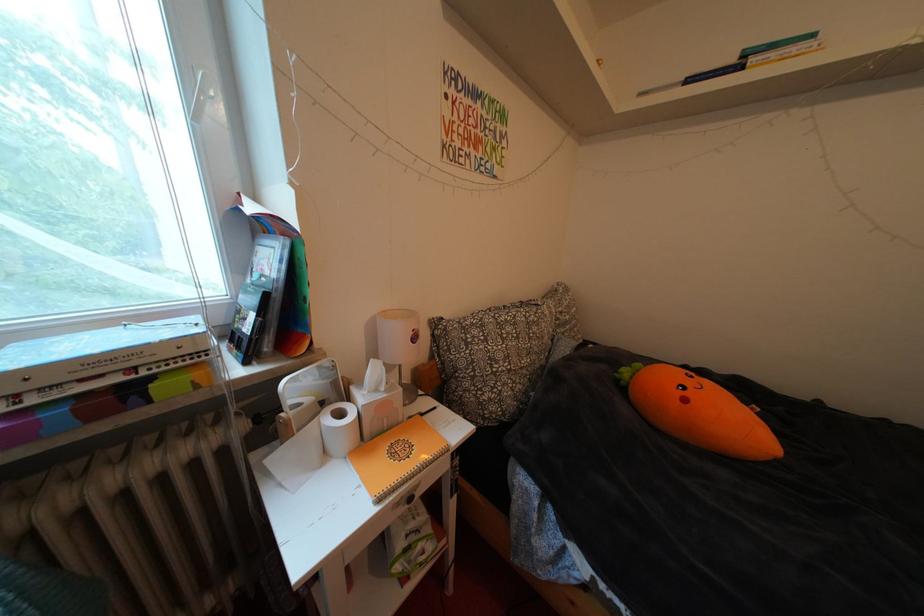
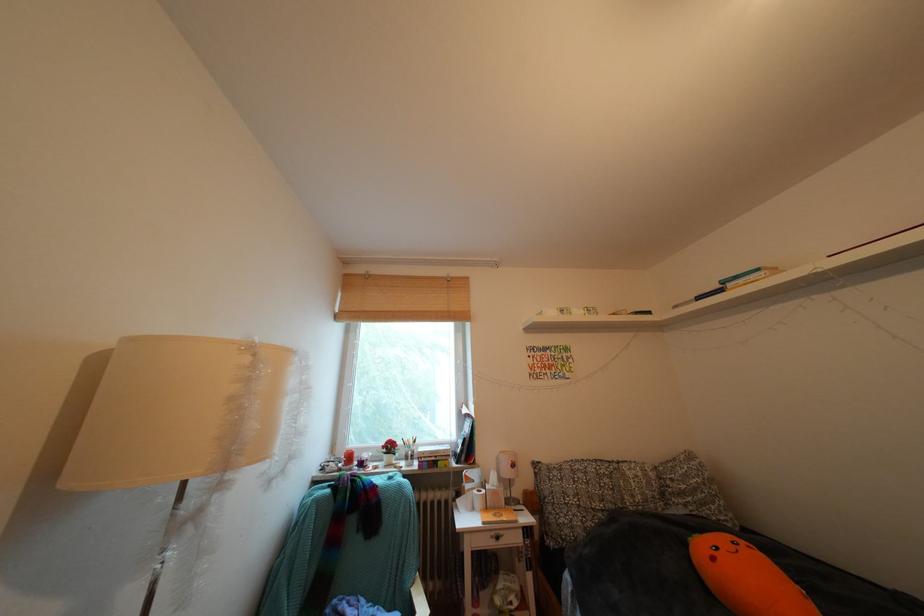
Find the pixel in the second image that matches the point at 695,405 in the first image.

(723, 564)